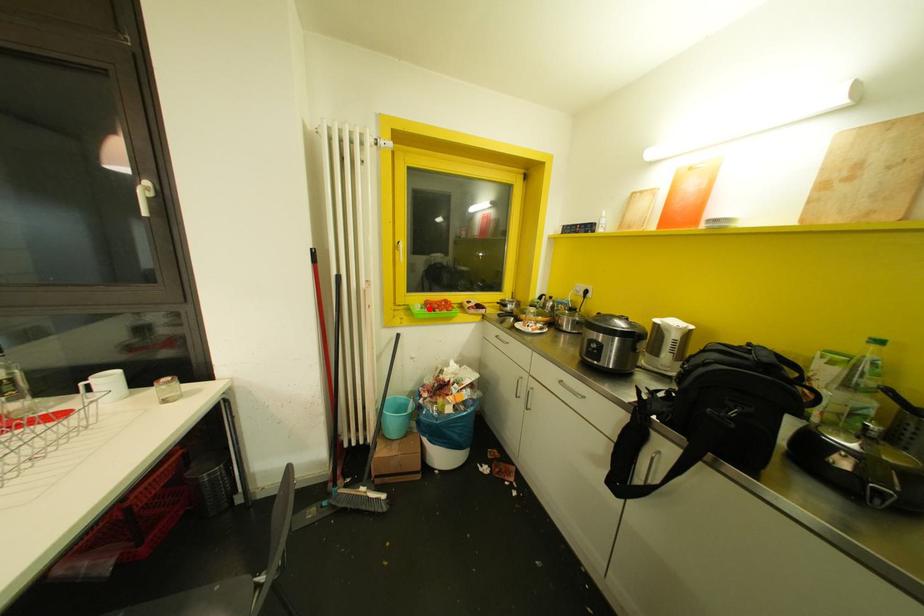
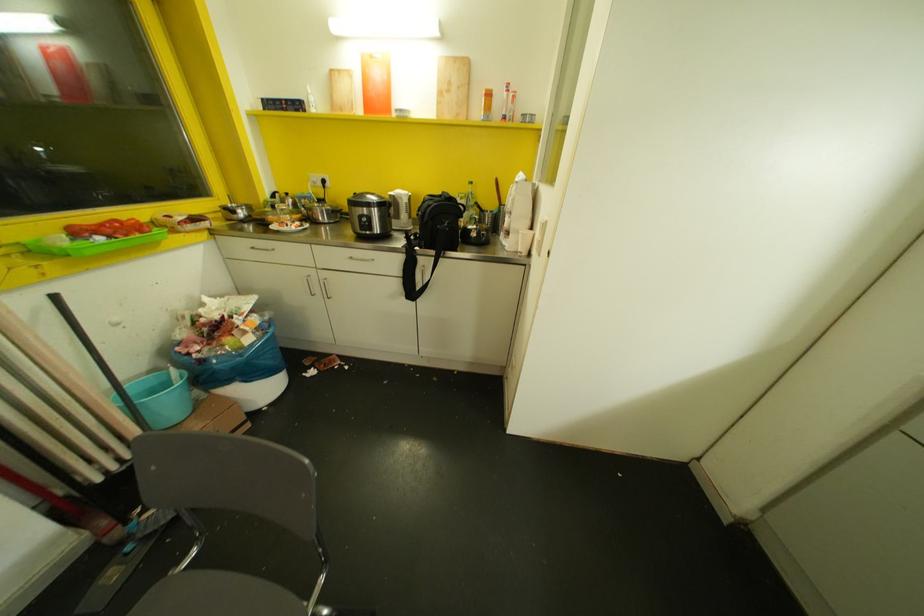
Locate, in the second image, the point that corresponds to the highlighted location in the first image.

(99, 237)